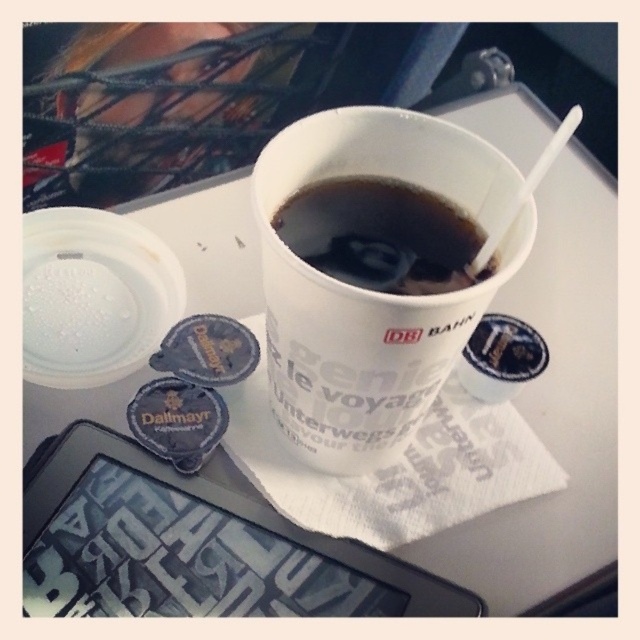
Question: Which object is closer to the camera taking this photo?

Choices:
 (A) white paper cup at center
 (B) black paper cup at upper center

Answer: (A)

Question: Which point appears closest to the camera in this image?

Choices:
 (A) (413, 288)
 (B) (372, 173)

Answer: (A)

Question: Is white paper cup at center smaller than black paper cup at upper center?

Choices:
 (A) yes
 (B) no

Answer: (B)

Question: Which point is farther to the camera?

Choices:
 (A) black paper cup at upper center
 (B) white paper cup at center

Answer: (A)

Question: In this image, where is white paper cup at center located relative to black paper cup at upper center?

Choices:
 (A) below
 (B) above

Answer: (A)

Question: Can you confirm if white paper cup at center is smaller than black paper cup at upper center?

Choices:
 (A) yes
 (B) no

Answer: (B)